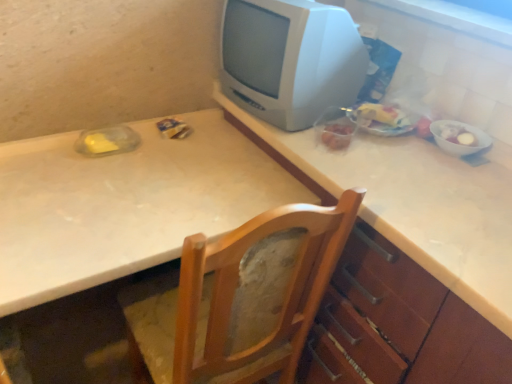
You are a GUI agent. You are given a task and a screenshot of the screen. Output one action in this format:
    pyautogui.click(x=<x>, y=<y>)
    Task: Click on the vacant area that is in front of white glossy bowl at right, which is the 2th food in left-to-right order
    Image resolution: width=512 pixels, height=384 pixels.
    Given the screenshot: What is the action you would take?
    pyautogui.click(x=471, y=169)